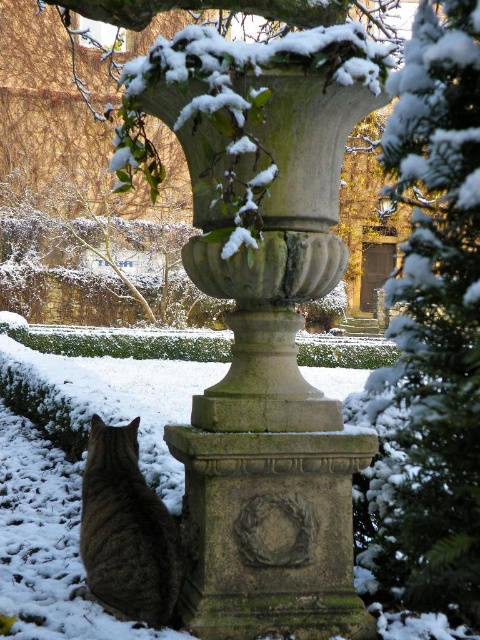
Question: In this image, where is snow-covered evergreen at right located relative to tabby fur cat at lower left?

Choices:
 (A) left
 (B) right

Answer: (B)

Question: Can you confirm if snow-covered evergreen at right is positioned above tabby fur cat at lower left?

Choices:
 (A) yes
 (B) no

Answer: (A)

Question: Which of the following is the closest to the observer?

Choices:
 (A) (418, 88)
 (B) (98, 582)

Answer: (A)

Question: Among these objects, which one is farthest from the camera?

Choices:
 (A) snow-covered evergreen at right
 (B) tabby fur cat at lower left

Answer: (B)

Question: Can you confirm if snow-covered evergreen at right is positioned to the right of tabby fur cat at lower left?

Choices:
 (A) no
 (B) yes

Answer: (B)

Question: Which of the following is the closest to the observer?

Choices:
 (A) tabby fur cat at lower left
 (B) snow-covered evergreen at right

Answer: (B)